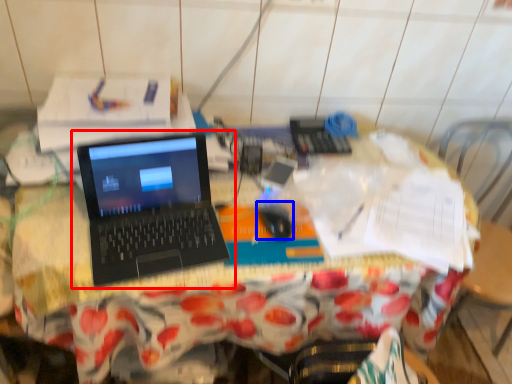
Question: Which object appears farthest to the camera in this image, laptop (highlighted by a red box) or mouse (highlighted by a blue box)?

Choices:
 (A) laptop
 (B) mouse

Answer: (B)